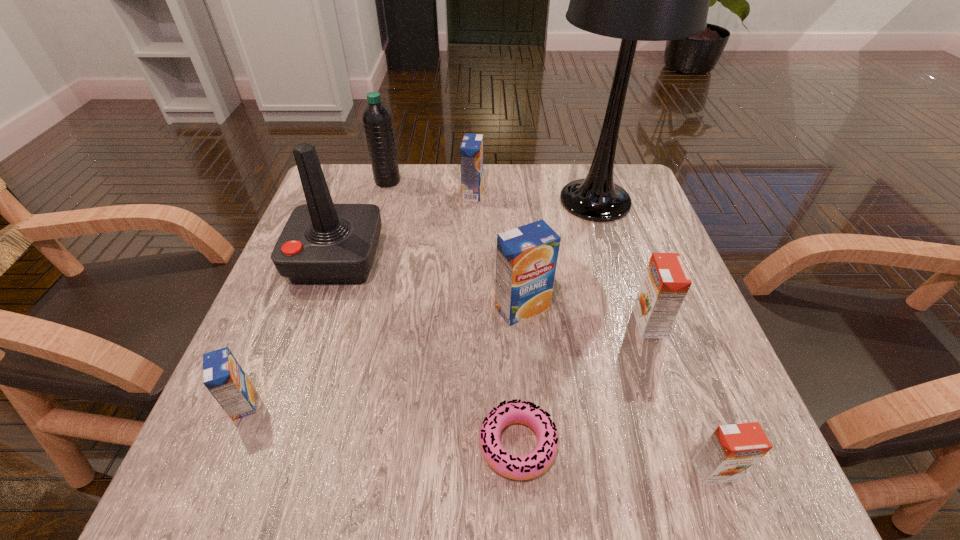
What are the coordinates of `object that ranks as the fourth closest to the leftmost blue orange_juice` in the screenshot? It's located at (377, 119).

Locate an element on the screen. orange juice that is the second closest one to the second smallest blue orange_juice is located at coordinates (666, 282).

Identify which orange juice is located as the third nearest to the doughnut. Please provide its 2D coordinates. Your answer should be formatted as a tuple, i.e. [(x, y)], where the tuple contains the x and y coordinates of a point satisfying the conditions above.

[(666, 282)]

Locate an element on the screen. This screenshot has height=540, width=960. the closest blue orange_juice relative to the doughnut is located at coordinates (526, 260).

The width and height of the screenshot is (960, 540). In order to click on blue orange_juice that is the nearest to the second blue orange_juice from right to left in this screenshot , I will do `click(526, 260)`.

Locate an element on the screen. The width and height of the screenshot is (960, 540). free space that satisfies the following two spatial constraints: 1. on the back side of the doughnut; 2. on the left side of the third orange juice from right to left is located at coordinates (509, 308).

Find the location of a particular element. The image size is (960, 540). vacant position in the image that satisfies the following two spatial constraints: 1. on the back side of the doughnut; 2. on the left side of the third orange juice from left to right is located at coordinates (509, 308).

This screenshot has width=960, height=540. What are the coordinates of `vacant space that satisfies the following two spatial constraints: 1. on the front side of the farthest blue orange_juice; 2. on the right side of the tallest object` in the screenshot? It's located at (472, 201).